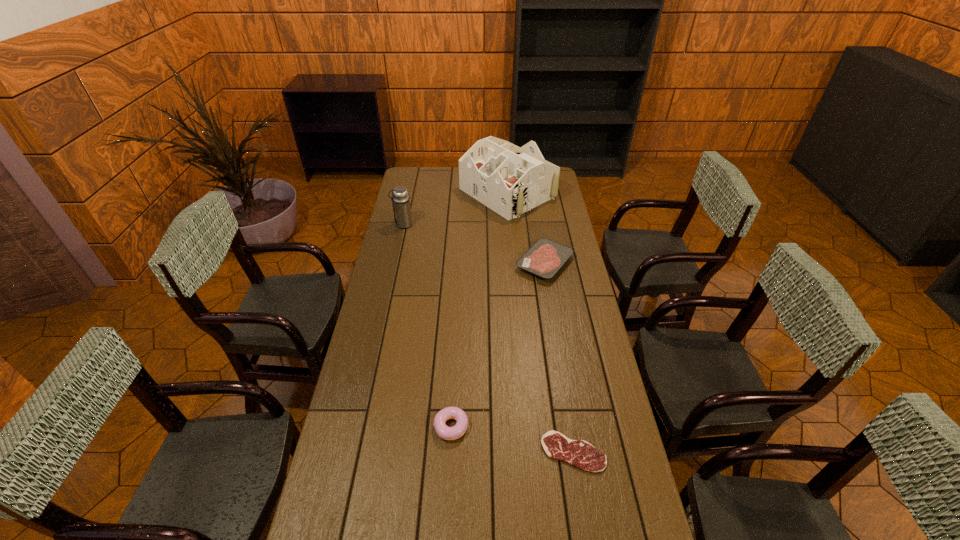
You are a GUI agent. You are given a task and a screenshot of the screen. Output one action in this format:
    pyautogui.click(x=<x>, y=<y>)
    Task: Click on the unoccupied position between the taller steak and the shortest object
    
    Given the screenshot: What is the action you would take?
    pyautogui.click(x=559, y=357)

Identify the location of free area in between the thermos bottle and the farther steak. The height and width of the screenshot is (540, 960). (474, 244).

Image resolution: width=960 pixels, height=540 pixels. Identify the location of unoccupied area between the fourth tallest object and the leftmost object. (474, 244).

Where is `free space between the thermos bottle and the tallest object`? Image resolution: width=960 pixels, height=540 pixels. free space between the thermos bottle and the tallest object is located at coordinates (455, 208).

Image resolution: width=960 pixels, height=540 pixels. I want to click on free space that is in between the dollhouse and the shortest object, so click(540, 322).

At what (x,y) coordinates should I click in order to perform the action: click on free space that is in between the dollhouse and the shortest object. Please return your answer as a coordinate pair (x, y). Looking at the image, I should click on (540, 322).

Where is `free space between the doughnut and the tallest object`? free space between the doughnut and the tallest object is located at coordinates 479,309.

The height and width of the screenshot is (540, 960). What are the coordinates of `free space between the thermos bottle and the shortest object` in the screenshot? It's located at (488, 338).

The image size is (960, 540). I want to click on free point between the shorter steak and the third tallest object, so click(x=512, y=439).

Find the location of a particular element. object that is the nearest to the dollhouse is located at coordinates (545, 257).